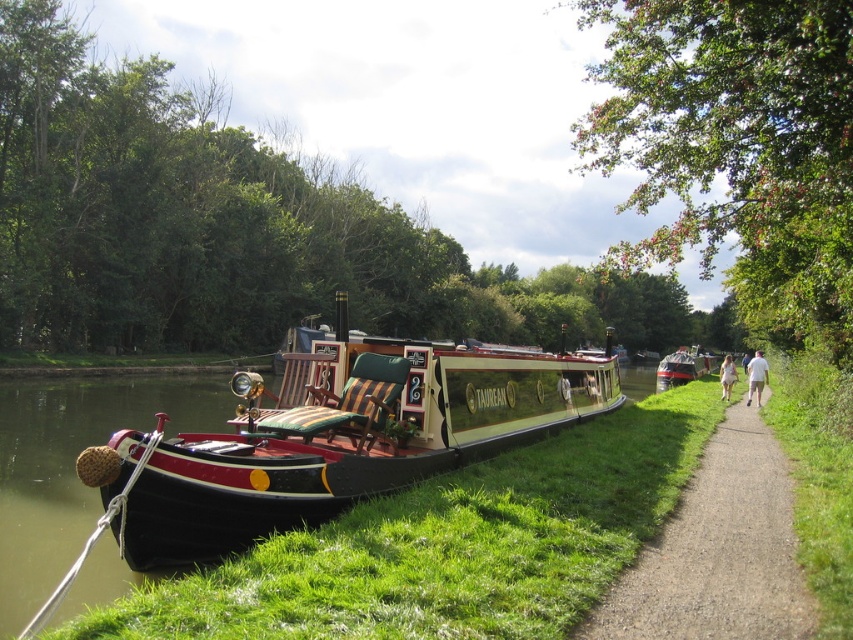
Question: Which of these objects is positioned farthest from the polished wood boat at center?

Choices:
 (A) gravel path at right
 (B) green polished wood boat at right
 (C) white cotton shirt at right
 (D) white cotton dress at right

Answer: (B)

Question: Which of the following is the farthest from the observer?

Choices:
 (A) polished wood boat at center
 (B) green grass at lower center
 (C) white cotton dress at right
 (D) green polished wood boat at right

Answer: (D)

Question: Does polished wood boat at center have a larger size compared to gravel path at right?

Choices:
 (A) yes
 (B) no

Answer: (A)

Question: Among these points, which one is farthest from the camera?

Choices:
 (A) (721, 378)
 (B) (546, 502)
 (C) (236, 531)
 (D) (758, 390)

Answer: (A)

Question: Can you confirm if green grass at lower center is positioned below polished wood boat at center?

Choices:
 (A) yes
 (B) no

Answer: (A)

Question: Does polished wood boat at center have a smaller size compared to white cotton dress at right?

Choices:
 (A) yes
 (B) no

Answer: (B)